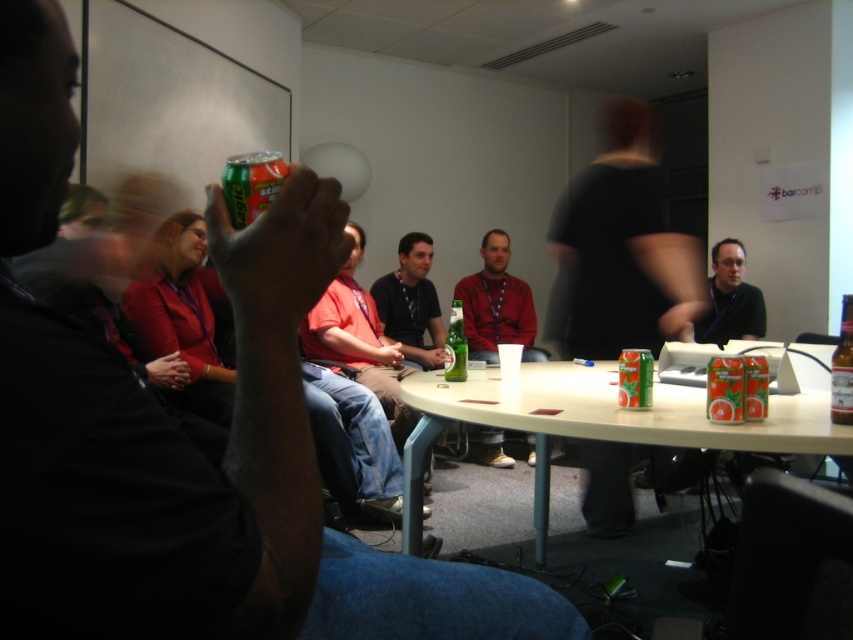
Question: Which point is farther to the camera?

Choices:
 (A) (843, 310)
 (B) (456, 314)

Answer: (B)

Question: Can you confirm if white plastic table at center is positioned above matte black shirt at lower right?

Choices:
 (A) no
 (B) yes

Answer: (A)

Question: Can you confirm if matte red shirt at center is smaller than matte black shirt at lower right?

Choices:
 (A) yes
 (B) no

Answer: (B)

Question: Is matte red shirt at center closer to camera compared to green matte can at center?

Choices:
 (A) yes
 (B) no

Answer: (B)

Question: Which object is farther from the camera taking this photo?

Choices:
 (A) matte black shirt at lower right
 (B) green glass bottle at center
 (C) green matte can at center

Answer: (A)

Question: Among these objects, which one is farthest from the camera?

Choices:
 (A) green glass bottle at center
 (B) matte red shirt at center
 (C) white plastic table at center

Answer: (B)